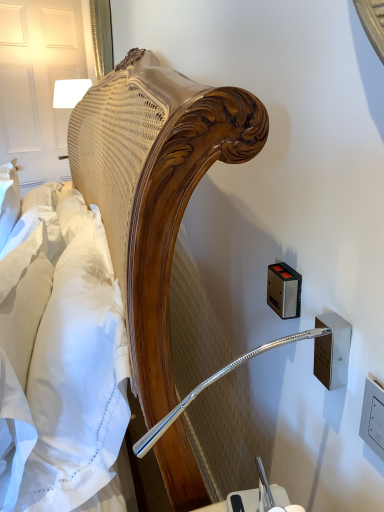
This screenshot has height=512, width=384. What do you see at coordinates (284, 290) in the screenshot?
I see `metallic rectangular at right, marked as the 2th electric outlet in a front-to-back arrangement` at bounding box center [284, 290].

Where is `white cotton sheet at left`? white cotton sheet at left is located at coordinates (61, 360).

Is wooden bedside lamp at upper left smaller than white cotton sheet at left?

Yes.

Considering the positions of points (62, 108) and (21, 506), is point (62, 108) closer to camera compared to point (21, 506)?

That is False.

Which object is positioned more to the left, wooden bedside lamp at upper left or white cotton sheet at left?

wooden bedside lamp at upper left.

Can white cotton sheet at left be found inside wooden bedside lamp at upper left?

Actually, white cotton sheet at left is outside wooden bedside lamp at upper left.

Is metallic silver outlet at right, marked as the second electric outlet in a left-to-right arrangement, taller or shorter than white cotton sheet at left?

metallic silver outlet at right, marked as the second electric outlet in a left-to-right arrangement, is shorter than white cotton sheet at left.

Based on the photo, what's the angular difference between metallic silver outlet at right, which is the 2th electric outlet from back to front, and white cotton sheet at left's facing directions?

They differ by 1.95 degrees in their facing directions.

Looking at this image, from a real-world perspective, is metallic silver outlet at right, which is counted as the 1th electric outlet, starting from the right, beneath white cotton sheet at left?

No, from a real-world perspective, metallic silver outlet at right, which is counted as the 1th electric outlet, starting from the right, is not below white cotton sheet at left.

Considering the sizes of metallic silver outlet at right, marked as the second electric outlet in a left-to-right arrangement, and white cotton sheet at left in the image, is metallic silver outlet at right, marked as the second electric outlet in a left-to-right arrangement, wider or thinner than white cotton sheet at left?

Clearly, metallic silver outlet at right, marked as the second electric outlet in a left-to-right arrangement, has less width compared to white cotton sheet at left.

From a real-world perspective, relative to white cotton sheet at left, is metallic rectangular at right, arranged as the first electric outlet when viewed from the back, vertically above or below?

From a real-world perspective, metallic rectangular at right, arranged as the first electric outlet when viewed from the back, is physically above white cotton sheet at left.

From the picture: Is metallic rectangular at right, marked as the 2th electric outlet in a front-to-back arrangement, taller than white cotton sheet at left?

In fact, metallic rectangular at right, marked as the 2th electric outlet in a front-to-back arrangement, may be shorter than white cotton sheet at left.

In the scene shown: Does metallic rectangular at right, marked as the 2th electric outlet in a front-to-back arrangement, have a larger size compared to white cotton sheet at left?

Actually, metallic rectangular at right, marked as the 2th electric outlet in a front-to-back arrangement, might be smaller than white cotton sheet at left.

There is a white cotton sheet at left. Where is `the 2nd electric outlet above it (from a real-world perspective)`? The height and width of the screenshot is (512, 384). the 2nd electric outlet above it (from a real-world perspective) is located at coordinates (284, 290).

Considering the positions of objects wooden bedside lamp at upper left and metallic rectangular at right, the 2th electric outlet from the right, in the image provided, who is more to the right, wooden bedside lamp at upper left or metallic rectangular at right, the 2th electric outlet from the right,?

Positioned to the right is metallic rectangular at right, the 2th electric outlet from the right.

Can we say wooden bedside lamp at upper left lies outside metallic rectangular at right, arranged as the 1th electric outlet when viewed from the left?

Indeed, wooden bedside lamp at upper left is completely outside metallic rectangular at right, arranged as the 1th electric outlet when viewed from the left.

Does wooden bedside lamp at upper left have a lesser height compared to metallic rectangular at right, the 2th electric outlet from the right?

No.

From the image's perspective, would you say wooden bedside lamp at upper left is shown under metallic rectangular at right, marked as the 2th electric outlet in a front-to-back arrangement?

Incorrect, from the image's perspective, wooden bedside lamp at upper left is higher than metallic rectangular at right, marked as the 2th electric outlet in a front-to-back arrangement.

Is metallic rectangular at right, arranged as the 1th electric outlet when viewed from the left, closer to the viewer compared to wooden bedside lamp at upper left?

That is True.

From a real-world perspective, is metallic rectangular at right, arranged as the 1th electric outlet when viewed from the left, positioned under wooden bedside lamp at upper left based on gravity?

Yes, from a real-world perspective, metallic rectangular at right, arranged as the 1th electric outlet when viewed from the left, is beneath wooden bedside lamp at upper left.

Considering the relative sizes of metallic rectangular at right, marked as the 2th electric outlet in a front-to-back arrangement, and wooden bedside lamp at upper left in the image provided, is metallic rectangular at right, marked as the 2th electric outlet in a front-to-back arrangement, thinner than wooden bedside lamp at upper left?

Yes, metallic rectangular at right, marked as the 2th electric outlet in a front-to-back arrangement, is thinner than wooden bedside lamp at upper left.

Does wooden bedside lamp at upper left have a greater height compared to metallic silver outlet at right, which is the 2th electric outlet from back to front?

Yes, wooden bedside lamp at upper left is taller than metallic silver outlet at right, which is the 2th electric outlet from back to front.

Based on the photo, is wooden bedside lamp at upper left in front of or behind metallic silver outlet at right, which is counted as the 1th electric outlet, starting from the right, in the image?

Visually, wooden bedside lamp at upper left is located behind metallic silver outlet at right, which is counted as the 1th electric outlet, starting from the right.

Which object is positioned more to the right, wooden bedside lamp at upper left or metallic silver outlet at right, which is the 2th electric outlet from back to front?

Positioned to the right is metallic silver outlet at right, which is the 2th electric outlet from back to front.

Is the depth of metallic rectangular at right, the 2th electric outlet from the right, greater than that of metallic silver outlet at right, which is counted as the 1th electric outlet, starting from the right?

Yes, it is behind metallic silver outlet at right, which is counted as the 1th electric outlet, starting from the right.

From the image's perspective, is metallic rectangular at right, the 2th electric outlet from the right, positioned above or below metallic silver outlet at right, the first electric outlet positioned from the front?

Clearly, from the image's perspective, metallic rectangular at right, the 2th electric outlet from the right, is above metallic silver outlet at right, the first electric outlet positioned from the front.

Considering the points (274, 265) and (321, 375), which point is behind, point (274, 265) or point (321, 375)?

Positioned behind is point (274, 265).

Consider the image. In the image, is metallic rectangular at right, the 2th electric outlet from the right, on the left side or the right side of metallic silver outlet at right, the first electric outlet positioned from the front?

From the image, it's evident that metallic rectangular at right, the 2th electric outlet from the right, is to the left of metallic silver outlet at right, the first electric outlet positioned from the front.

There is a white cotton sheet at left. At what (x,y) coordinates should I click in order to perform the action: click on bedside lamp above it (from a real-world perspective). Please return your answer as a coordinate pair (x, y). This screenshot has width=384, height=512. Looking at the image, I should click on (69, 92).

In order to click on sheet that is in front of the metallic silver outlet at right, the first electric outlet positioned from the front in this screenshot , I will do [61, 360].

From the image, which object appears to be farther from white cotton sheet at left, wooden bedside lamp at upper left or metallic rectangular at right, the 2th electric outlet from the right?

wooden bedside lamp at upper left.

Looking at the image, which one is located further to wooden bedside lamp at upper left, metallic rectangular at right, arranged as the first electric outlet when viewed from the back, or metallic silver outlet at right, the first electric outlet positioned from the front?

Among the two, metallic silver outlet at right, the first electric outlet positioned from the front, is located further to wooden bedside lamp at upper left.

When comparing their distances from metallic silver outlet at right, marked as the second electric outlet in a left-to-right arrangement, does metallic rectangular at right, arranged as the 1th electric outlet when viewed from the left, or white cotton sheet at left seem closer?

metallic rectangular at right, arranged as the 1th electric outlet when viewed from the left, is positioned closer to the anchor metallic silver outlet at right, marked as the second electric outlet in a left-to-right arrangement.

Based on their spatial positions, is wooden bedside lamp at upper left or white cotton sheet at left closer to metallic rectangular at right, the 2th electric outlet from the right?

Based on the image, white cotton sheet at left appears to be nearer to metallic rectangular at right, the 2th electric outlet from the right.

Estimate the real-world distances between objects in this image. Which object is closer to wooden bedside lamp at upper left, metallic silver outlet at right, which is counted as the 1th electric outlet, starting from the right, or white cotton sheet at left?

Among the two, white cotton sheet at left is located nearer to wooden bedside lamp at upper left.

Considering their positions, is metallic rectangular at right, marked as the 2th electric outlet in a front-to-back arrangement, positioned closer to white cotton sheet at left than wooden bedside lamp at upper left?

Based on the image, metallic rectangular at right, marked as the 2th electric outlet in a front-to-back arrangement, appears to be nearer to white cotton sheet at left.

From the image, which object appears to be farther from white cotton sheet at left, metallic silver outlet at right, marked as the second electric outlet in a left-to-right arrangement, or wooden bedside lamp at upper left?

wooden bedside lamp at upper left is positioned further to the anchor white cotton sheet at left.

Looking at the image, which one is located closer to metallic rectangular at right, marked as the 2th electric outlet in a front-to-back arrangement, white cotton sheet at left or metallic silver outlet at right, which is the 2th electric outlet from back to front?

metallic silver outlet at right, which is the 2th electric outlet from back to front, lies closer to metallic rectangular at right, marked as the 2th electric outlet in a front-to-back arrangement, than the other object.

Identify the location of electric outlet between metallic silver outlet at right, which is the 2th electric outlet from back to front, and wooden bedside lamp at upper left, along the z-axis. (284, 290).

The height and width of the screenshot is (512, 384). Find the location of `electric outlet between white cotton sheet at left and metallic silver outlet at right, which is the 2th electric outlet from back to front`. electric outlet between white cotton sheet at left and metallic silver outlet at right, which is the 2th electric outlet from back to front is located at coordinates (284, 290).